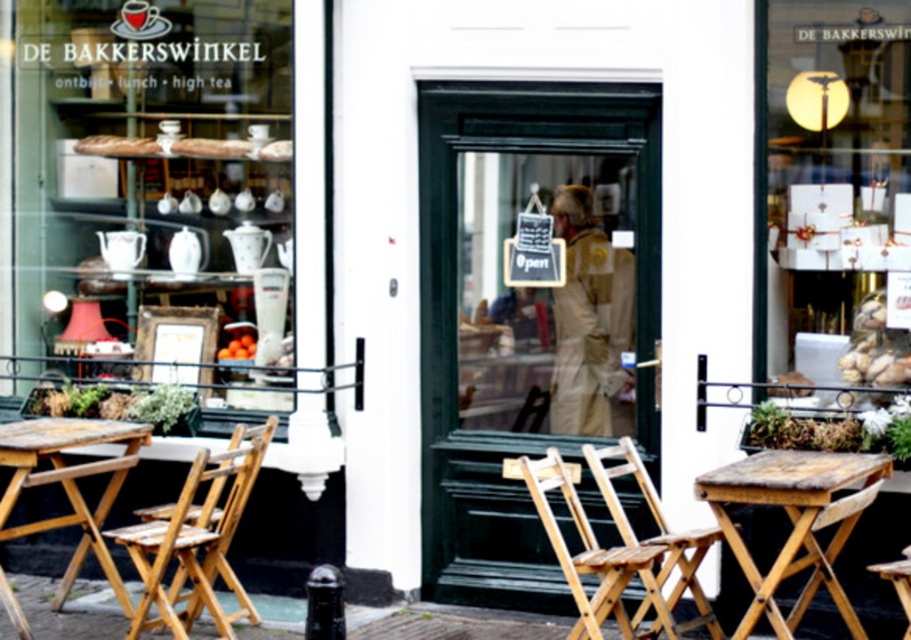
Question: Is white paper gift boxes at upper center above wooden folding chair at lower right?

Choices:
 (A) yes
 (B) no

Answer: (A)

Question: Among these points, which one is farthest from the camera?

Choices:
 (A) (134, 627)
 (B) (572, 120)

Answer: (B)

Question: Can you confirm if matte white ceramic teapot at upper center is smaller than green wooden door at center?

Choices:
 (A) yes
 (B) no

Answer: (B)

Question: Which point is closer to the camera?

Choices:
 (A) wooden folding chair at center
 (B) wooden table at lower left
 (C) white paper gift boxes at upper center
 (D) green wooden door at center

Answer: (A)

Question: Can you confirm if matte white ceramic teapot at upper center is positioned to the right of wooden rustic table at center?

Choices:
 (A) yes
 (B) no

Answer: (B)

Question: Which of these objects is positioned farthest from the green wooden door at center?

Choices:
 (A) matte white ceramic teapot at upper center
 (B) wooden folding chair at lower right

Answer: (A)